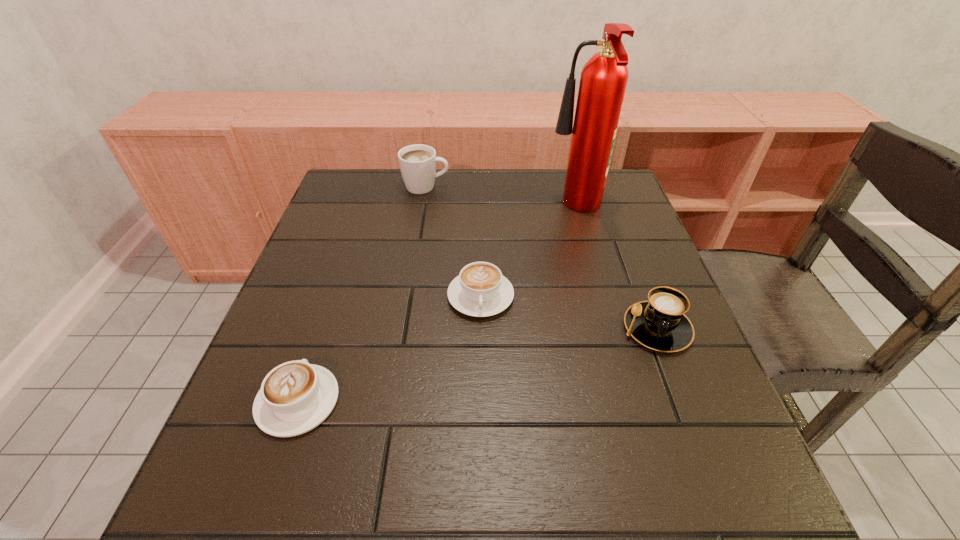
Image resolution: width=960 pixels, height=540 pixels. Identify the location of vacant area that lies between the fire extinguisher and the second cappuccino from right to left. (528, 253).

Locate an element on the screen. The width and height of the screenshot is (960, 540). empty location between the rightmost cappuccino and the third object from left to right is located at coordinates (568, 312).

Locate an element on the screen. blank region between the nearest cappuccino and the second tallest object is located at coordinates (362, 294).

Locate an element on the screen. The height and width of the screenshot is (540, 960). blank region between the second cappuccino from right to left and the leftmost object is located at coordinates (389, 349).

The height and width of the screenshot is (540, 960). What are the coordinates of `free space between the tallest object and the third cappuccino from left to right` in the screenshot? It's located at (528, 253).

This screenshot has width=960, height=540. What are the coordinates of `unoccupied position between the third object from right to left and the third shortest cappuccino` in the screenshot? It's located at (568, 312).

The width and height of the screenshot is (960, 540). I want to click on unoccupied area between the nearest cappuccino and the rightmost cappuccino, so click(x=477, y=364).

What are the coordinates of `vacant space that's between the leftmost object and the farthest cappuccino` in the screenshot? It's located at (362, 294).

Locate which object ranks in proximity to the second object from left to right. Please provide its 2D coordinates. Your answer should be formatted as a tuple, i.e. [(x, y)], where the tuple contains the x and y coordinates of a point satisfying the conditions above.

[(603, 80)]

Select which object appears as the closest to the tallest object. Please provide its 2D coordinates. Your answer should be formatted as a tuple, i.e. [(x, y)], where the tuple contains the x and y coordinates of a point satisfying the conditions above.

[(480, 290)]